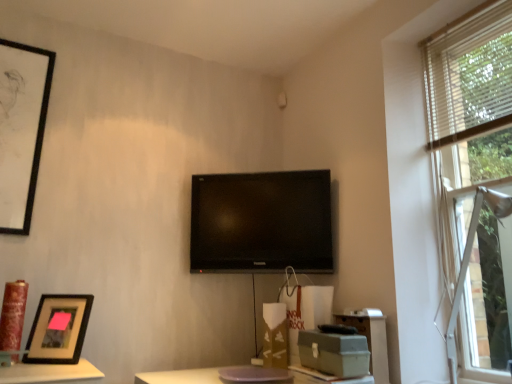
Question: Can you confirm if black matte picture frame at lower left, which is counted as the second picture frame, starting from the back, is smaller than matte gray file cabinet at lower right?

Choices:
 (A) yes
 (B) no

Answer: (A)

Question: Is black matte picture frame at lower left, which is the 2th picture frame in left-to-right order, wider than matte gray file cabinet at lower right?

Choices:
 (A) yes
 (B) no

Answer: (A)

Question: Considering the relative sizes of black matte picture frame at lower left, arranged as the 2th picture frame when viewed from the top, and matte gray file cabinet at lower right in the image provided, is black matte picture frame at lower left, arranged as the 2th picture frame when viewed from the top, taller than matte gray file cabinet at lower right?

Choices:
 (A) no
 (B) yes

Answer: (A)

Question: Could you tell me if black matte picture frame at lower left, which is counted as the first picture frame, starting from the right, is facing matte gray file cabinet at lower right?

Choices:
 (A) no
 (B) yes

Answer: (A)

Question: Is black matte picture frame at lower left, arranged as the 2th picture frame when viewed from the top, positioned in front of matte gray file cabinet at lower right?

Choices:
 (A) no
 (B) yes

Answer: (B)

Question: From the image's perspective, is matte gray cardboard box at lower right, marked as the first cardboard box in a right-to-left arrangement, above or below brown cardboard box at center, which is the second cardboard box in right-to-left order?

Choices:
 (A) above
 (B) below

Answer: (A)

Question: In terms of width, does matte gray cardboard box at lower right, marked as the first cardboard box in a right-to-left arrangement, look wider or thinner when compared to brown cardboard box at center, which is the second cardboard box in right-to-left order?

Choices:
 (A) thin
 (B) wide

Answer: (B)

Question: Is matte gray cardboard box at lower right, which is counted as the 2th cardboard box, starting from the left, in front of or behind brown cardboard box at center, which is counted as the 2th cardboard box, starting from the front, in the image?

Choices:
 (A) behind
 (B) front

Answer: (B)

Question: Based on their sizes in the image, would you say matte gray cardboard box at lower right, the 1th cardboard box positioned from the front, is bigger or smaller than brown cardboard box at center, positioned as the 1th cardboard box in back-to-front order?

Choices:
 (A) big
 (B) small

Answer: (A)

Question: In terms of height, does black matte picture frame at upper left, the 1th picture frame positioned from the top, look taller or shorter compared to white wood blinds at upper right?

Choices:
 (A) tall
 (B) short

Answer: (A)

Question: From a real-world perspective, is black matte picture frame at upper left, acting as the first picture frame starting from the left, above or below white wood blinds at upper right?

Choices:
 (A) below
 (B) above

Answer: (A)

Question: In the image, is black matte picture frame at upper left, which is counted as the second picture frame, starting from the bottom, positioned in front of or behind white wood blinds at upper right?

Choices:
 (A) behind
 (B) front

Answer: (A)

Question: Considering the relative positions of black matte picture frame at upper left, which appears as the 2th picture frame when viewed from the right, and white wood blinds at upper right in the image provided, is black matte picture frame at upper left, which appears as the 2th picture frame when viewed from the right, to the left or to the right of white wood blinds at upper right?

Choices:
 (A) left
 (B) right

Answer: (A)

Question: From their relative heights in the image, would you say brown cardboard box at center, which is counted as the 2th cardboard box, starting from the front, is taller or shorter than white wood blinds at upper right?

Choices:
 (A) short
 (B) tall

Answer: (A)

Question: Is brown cardboard box at center, which is counted as the 2th cardboard box, starting from the front, situated inside white wood blinds at upper right or outside?

Choices:
 (A) inside
 (B) outside

Answer: (B)